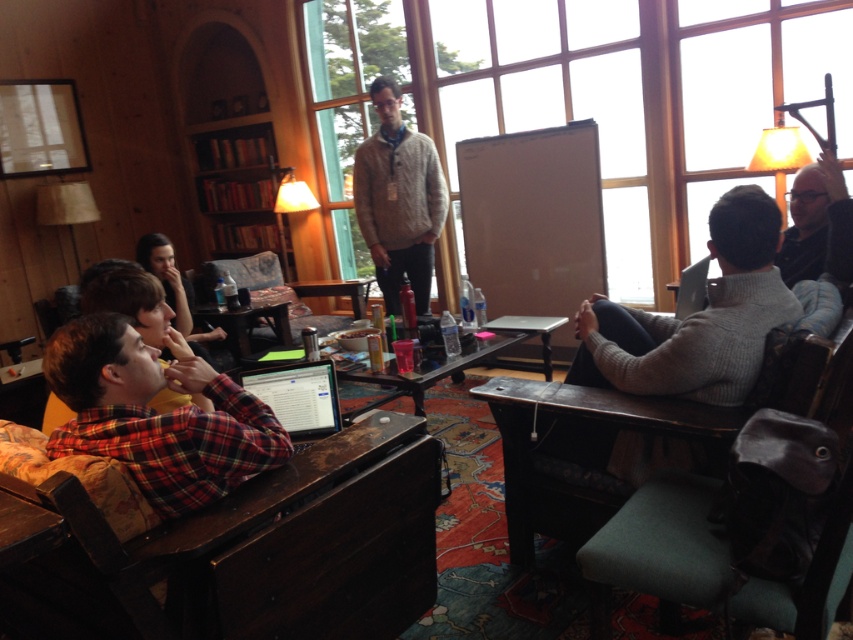
Question: Which point is farther to the camera?

Choices:
 (A) (450, 362)
 (B) (685, 413)
 (C) (425, 236)
 (D) (292, 381)

Answer: (C)

Question: Does red plaid shirt at lower left have a larger size compared to wooden bookshelf at upper left?

Choices:
 (A) yes
 (B) no

Answer: (B)

Question: Which object appears closest to the camera in this image?

Choices:
 (A) knit sweater at center
 (B) wooden bookshelf at upper left

Answer: (A)

Question: Which of the following is the farthest from the observer?

Choices:
 (A) (252, 452)
 (B) (248, 140)
 (C) (318, 371)
 (D) (271, 291)

Answer: (B)

Question: Is matte black laptop at lower left behind wooden table at center?

Choices:
 (A) no
 (B) yes

Answer: (A)

Question: Is red plaid shirt at lower left thinner than wooden bookshelf at upper left?

Choices:
 (A) yes
 (B) no

Answer: (A)